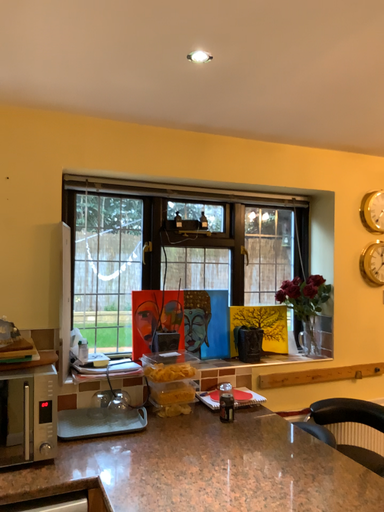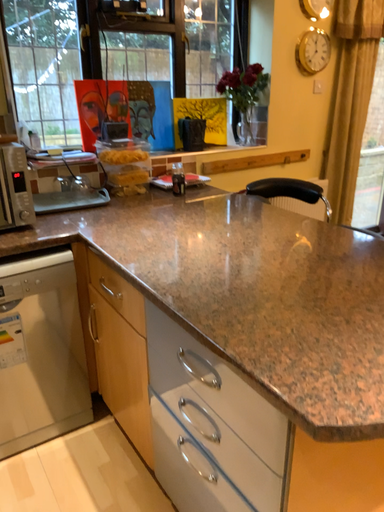
Question: How did the camera likely rotate when shooting the video?

Choices:
 (A) rotated upward
 (B) rotated downward

Answer: (B)